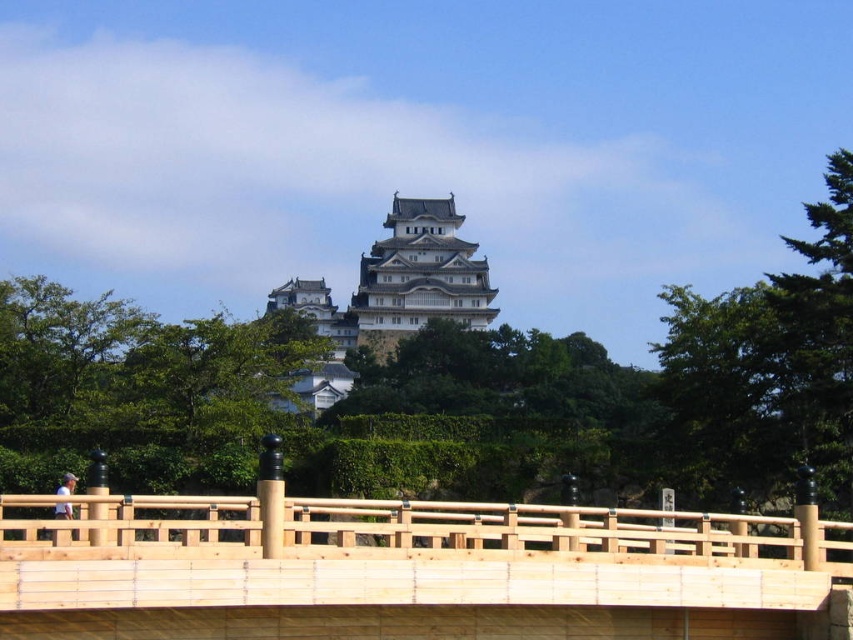
Between green leafy tree at upper right and white stone tower at center, which one has less height?

green leafy tree at upper right is shorter.

Does green leafy tree at upper right appear on the right side of white stone tower at center?

Yes, green leafy tree at upper right is to the right of white stone tower at center.

Is point (670, 397) positioned after point (426, 278)?

No.

Find the location of a particular element. green leafy tree at upper right is located at coordinates click(769, 365).

Does light brown wooden bridge at center lie in front of white stone tower at center?

That is True.

Is point (254, 627) positioned after point (373, 243)?

No, it is in front of (373, 243).

The width and height of the screenshot is (853, 640). Find the location of `light brown wooden bridge at center`. light brown wooden bridge at center is located at coordinates (405, 572).

Who is more forward, (802,596) or (722,349)?

Point (802,596)

The width and height of the screenshot is (853, 640). What do you see at coordinates (405, 572) in the screenshot? I see `light brown wooden bridge at center` at bounding box center [405, 572].

I want to click on light brown wooden bridge at center, so click(405, 572).